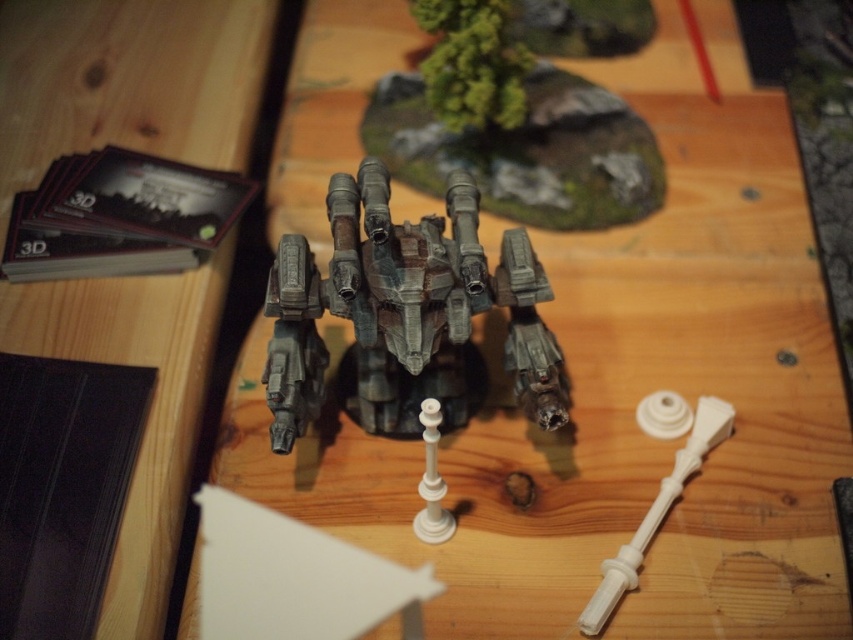
You are a model assembler who needs to attach the white plastic handle at center to the rusty metal mech at center. Given their sizes, will the handle fit proportionally on the mech?

The rusty metal mech at center is larger than the white plastic handle at center, so the handle will fit proportionally on the mech.

Looking at this image, you are a model builder who needs to place the rusty metal mech at center onto the rustic metal terrain at upper center. Given that the minimum safe distance required for a stable placement is 20 inches, can you safely place the mech on the terrain?

The rusty metal mech at center is 19.63 inches from rustic metal terrain at upper center. Since the required distance for stable placement is 20 inches, the current distance is insufficient. Therefore, you cannot safely place the mech on the terrain at this distance.